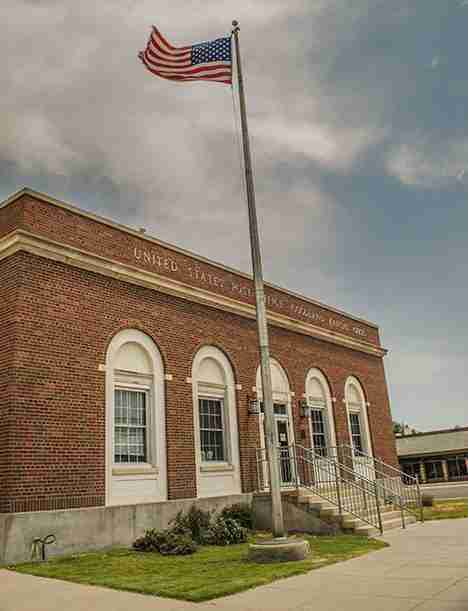
You are a GUI agent. You are given a task and a screenshot of the screen. Output one action in this format:
    pyautogui.click(x=<x>, y=<y>)
    Task: Click on the window
    Image resolution: width=468 pixels, height=611 pixels.
    Given the screenshot: What is the action you would take?
    pyautogui.click(x=128, y=410), pyautogui.click(x=210, y=412), pyautogui.click(x=318, y=419), pyautogui.click(x=353, y=425)